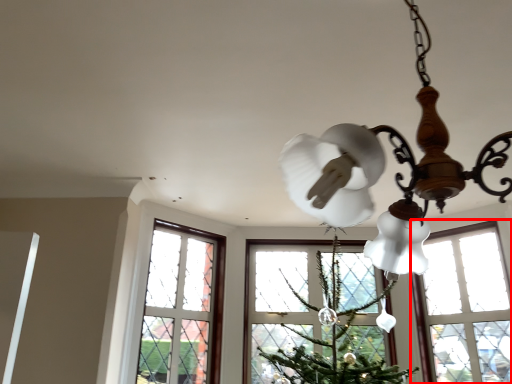
Question: Observing the image, what is the correct spatial positioning of window (annotated by the red box) in reference to lamp?

Choices:
 (A) right
 (B) left

Answer: (A)